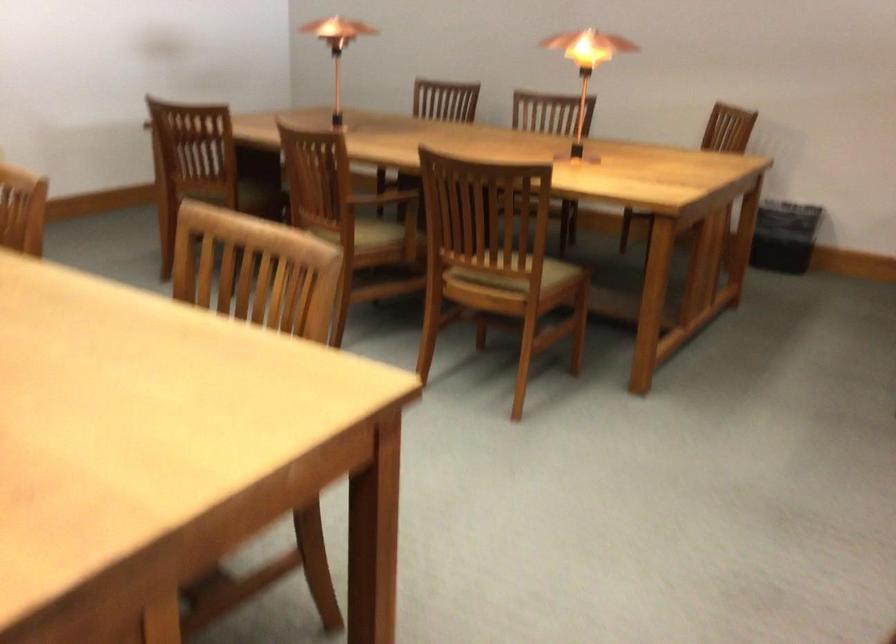
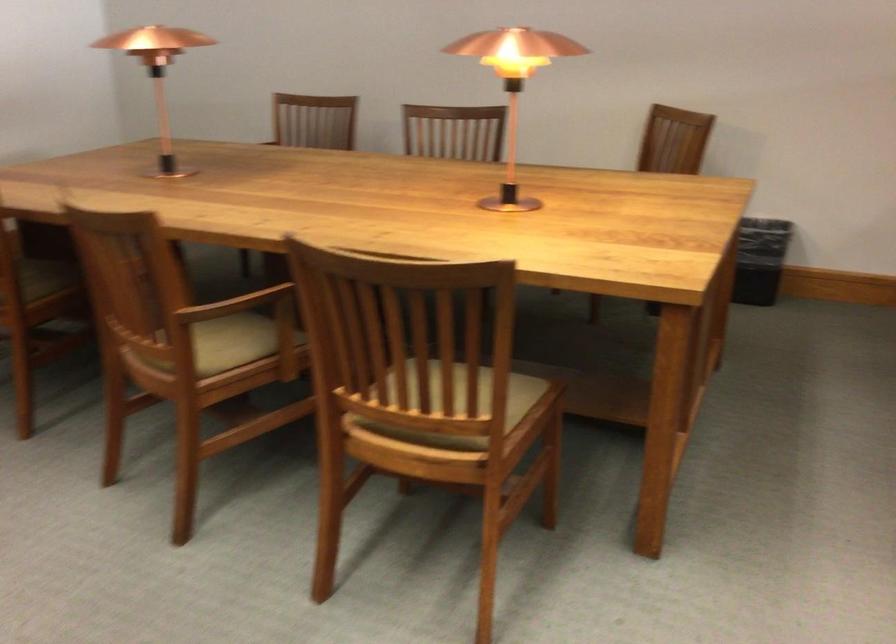
In the second image, find the point that corresponds to pixel 789 210 in the first image.

(760, 260)